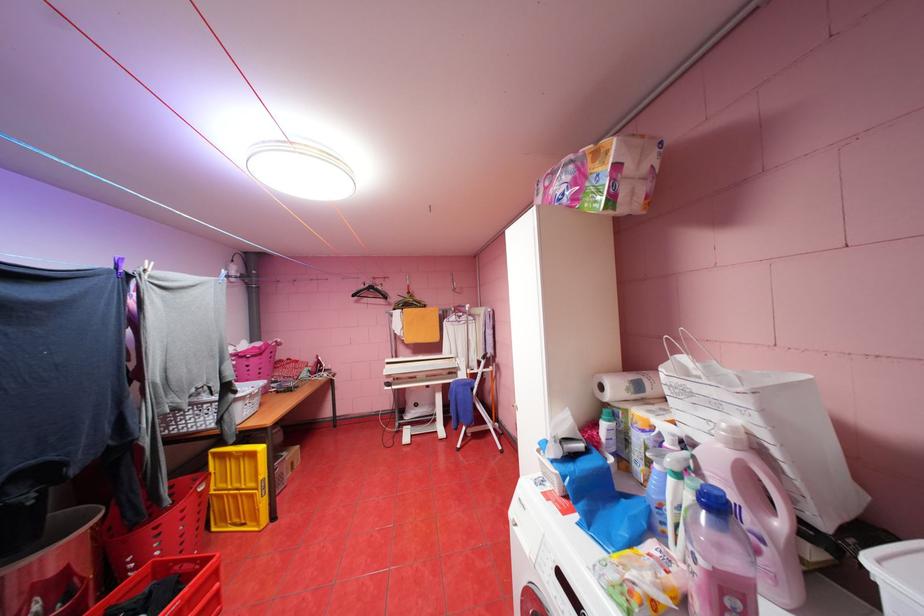
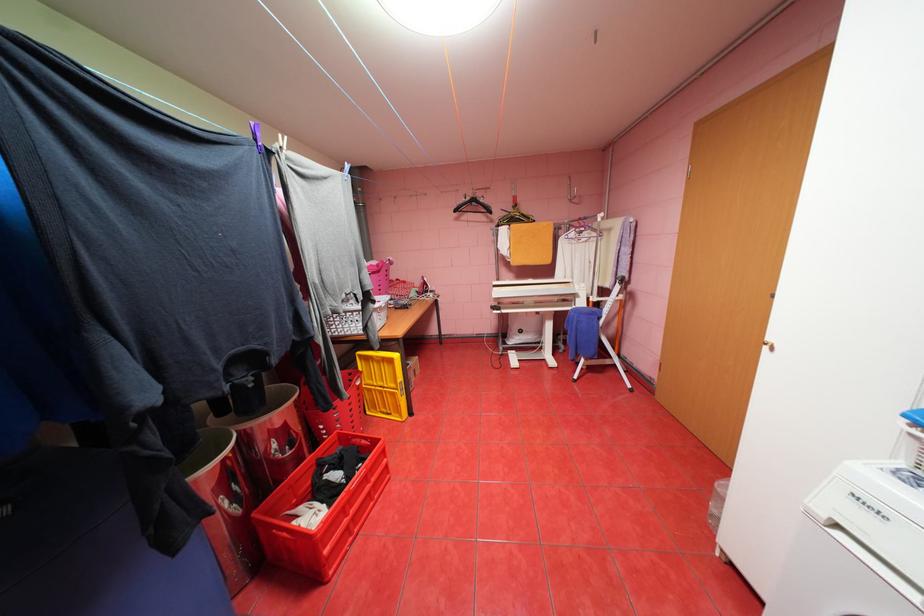
The images are taken continuously from a first-person perspective. In which direction are you moving?

The cameraman moved toward left, forward.